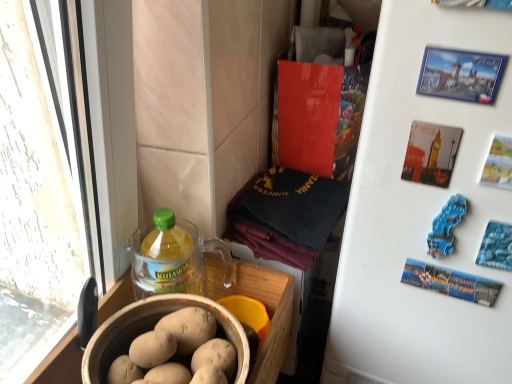
Question: Is matte brown bowl at lower left closer to the viewer compared to translucent plastic bottle at lower left?

Choices:
 (A) yes
 (B) no

Answer: (A)

Question: Would you say matte brown bowl at lower left is outside translucent plastic bottle at lower left?

Choices:
 (A) no
 (B) yes

Answer: (B)

Question: Is matte brown bowl at lower left to the left of translucent plastic bottle at lower left from the viewer's perspective?

Choices:
 (A) yes
 (B) no

Answer: (B)

Question: Considering the relative sizes of matte brown bowl at lower left and translucent plastic bottle at lower left in the image provided, is matte brown bowl at lower left smaller than translucent plastic bottle at lower left?

Choices:
 (A) no
 (B) yes

Answer: (A)

Question: Is matte brown bowl at lower left taller than translucent plastic bottle at lower left?

Choices:
 (A) no
 (B) yes

Answer: (A)

Question: Considering the positions of white matte refrigerator at upper right and matte brown bowl at lower left in the image, is white matte refrigerator at upper right taller or shorter than matte brown bowl at lower left?

Choices:
 (A) tall
 (B) short

Answer: (A)

Question: Based on their sizes in the image, would you say white matte refrigerator at upper right is bigger or smaller than matte brown bowl at lower left?

Choices:
 (A) small
 (B) big

Answer: (B)

Question: Considering their positions, is white matte refrigerator at upper right located in front of or behind matte brown bowl at lower left?

Choices:
 (A) behind
 (B) front

Answer: (B)

Question: From a real-world perspective, is white matte refrigerator at upper right positioned above or below matte brown bowl at lower left?

Choices:
 (A) above
 (B) below

Answer: (B)

Question: Looking at their shapes, would you say matte brown bowl at lower left is wider or thinner than translucent plastic bottle at lower left?

Choices:
 (A) thin
 (B) wide

Answer: (B)

Question: Does point (119, 347) appear closer or farther from the camera than point (133, 236)?

Choices:
 (A) closer
 (B) farther

Answer: (A)

Question: From the image's perspective, is matte brown bowl at lower left positioned above or below translucent plastic bottle at lower left?

Choices:
 (A) below
 (B) above

Answer: (A)

Question: From their relative heights in the image, would you say matte brown bowl at lower left is taller or shorter than translucent plastic bottle at lower left?

Choices:
 (A) tall
 (B) short

Answer: (B)

Question: Do you think blue plastic magnet at upper right is within white matte refrigerator at upper right, or outside of it?

Choices:
 (A) outside
 (B) inside

Answer: (B)

Question: From the image's perspective, relative to white matte refrigerator at upper right, is blue plastic magnet at upper right above or below?

Choices:
 (A) above
 (B) below

Answer: (A)